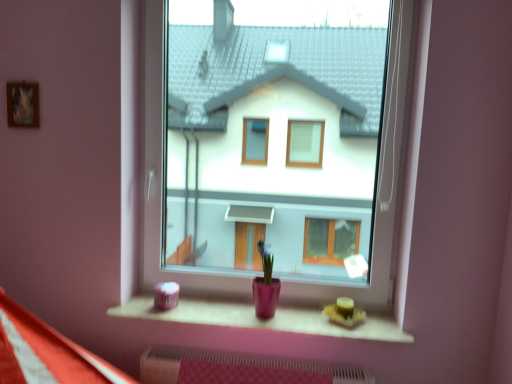
Question: Is transparent glass window at center oriented away from wooden frame at upper left?

Choices:
 (A) yes
 (B) no

Answer: (B)

Question: Is transparent glass window at center aimed at wooden frame at upper left?

Choices:
 (A) yes
 (B) no

Answer: (B)

Question: From a real-world perspective, is transparent glass window at center physically below wooden frame at upper left?

Choices:
 (A) no
 (B) yes

Answer: (B)

Question: Is the surface of transparent glass window at center in direct contact with wooden frame at upper left?

Choices:
 (A) yes
 (B) no

Answer: (B)

Question: Is transparent glass window at center completely or partially outside of wooden frame at upper left?

Choices:
 (A) no
 (B) yes

Answer: (B)

Question: Looking at their shapes, would you say transparent glass window at center is wider or thinner than wooden frame at upper left?

Choices:
 (A) wide
 (B) thin

Answer: (A)

Question: Is transparent glass window at center situated inside wooden frame at upper left or outside?

Choices:
 (A) outside
 (B) inside

Answer: (A)

Question: From a real-world perspective, is transparent glass window at center above or below wooden frame at upper left?

Choices:
 (A) below
 (B) above

Answer: (A)

Question: Considering the positions of point (394, 57) and point (16, 114), is point (394, 57) closer or farther from the camera than point (16, 114)?

Choices:
 (A) farther
 (B) closer

Answer: (A)

Question: Considering the positions of matte pink wood at lower center and wooden frame at upper left in the image, is matte pink wood at lower center wider or thinner than wooden frame at upper left?

Choices:
 (A) wide
 (B) thin

Answer: (A)

Question: From a real-world perspective, is matte pink wood at lower center above or below wooden frame at upper left?

Choices:
 (A) above
 (B) below

Answer: (B)

Question: Based on their positions, is matte pink wood at lower center located to the left or right of wooden frame at upper left?

Choices:
 (A) right
 (B) left

Answer: (A)

Question: Is matte pink wood at lower center taller or shorter than wooden frame at upper left?

Choices:
 (A) short
 (B) tall

Answer: (A)

Question: From a real-world perspective, relative to matte pink wood at lower center, is wooden frame at upper left vertically above or below?

Choices:
 (A) below
 (B) above

Answer: (B)

Question: From the image's perspective, is wooden frame at upper left above or below matte pink wood at lower center?

Choices:
 (A) below
 (B) above

Answer: (B)